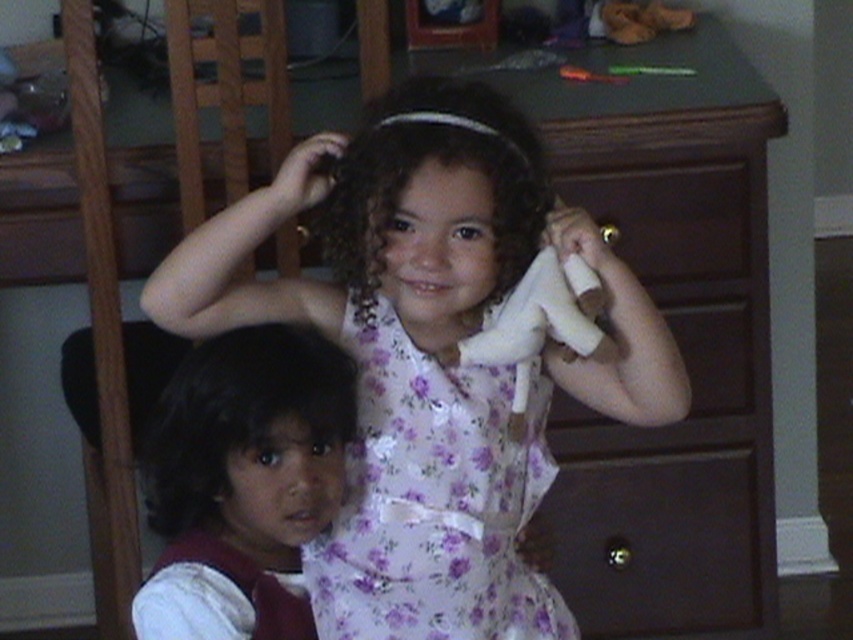
You are standing at the point labeled as point [480,198] in the image. You want to take a photo of the two children using a camera that requires you to be at least 4 feet away from the subject to focus properly. Can you successfully take a clear photo of the children from your current position?

The distance between point [480,198] and the camera is 4.06 feet, which is just over the minimum required distance of 4 feet. Therefore, you can successfully take a clear photo of the children from your current position.

You are a photographer setting up a shot in this room. You want to ensure both the curly brown hair at center and the brown wood drawer at center are visible in the frame. Based on their positions, which object is closer to the left edge of the image?

The curly brown hair at center is positioned on the left side of brown wood drawer at center, so it is closer to the left edge of the image.